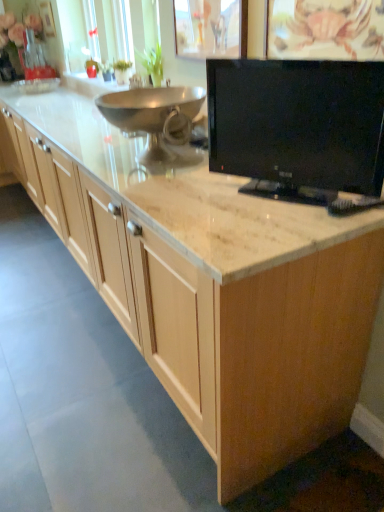
At what (x,y) coordinates should I click in order to perform the action: click on free space in front of black glossy tv at upper right. Please return your answer as a coordinate pair (x, y). Looking at the image, I should click on 278,228.